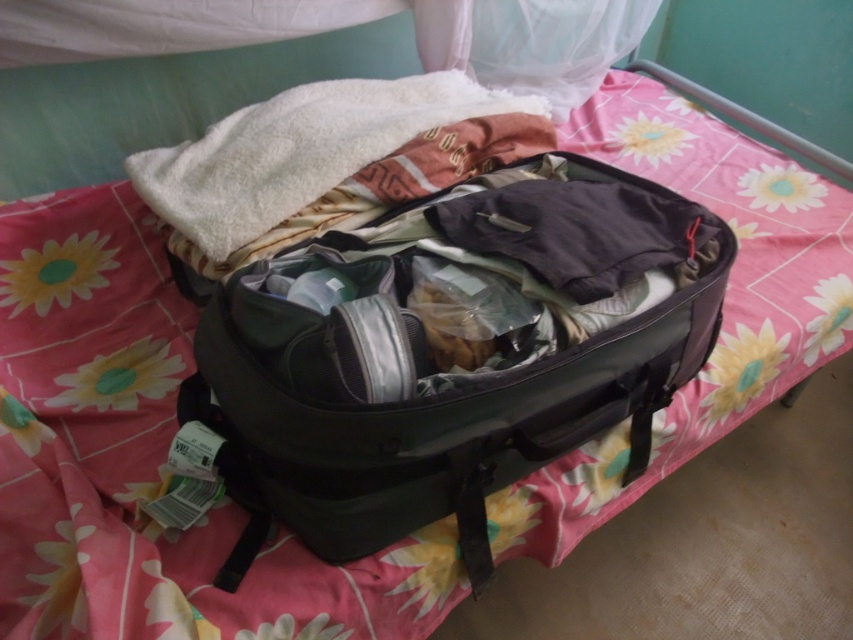
Which is in front, point (294, 396) or point (405, 76)?

Point (294, 396)

Is black fabric suitcase at center below white fluffy towel at center?

Yes.

Is point (724, 225) behind point (202, 145)?

No, (724, 225) is in front of (202, 145).

Where is `black fabric suitcase at center`? The image size is (853, 640). black fabric suitcase at center is located at coordinates (439, 355).